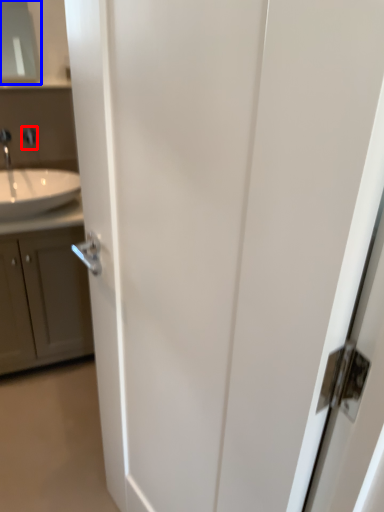
Question: Which of the following is the closest to the observer, faucet (highlighted by a red box) or medicine cabinet (highlighted by a blue box)?

Choices:
 (A) faucet
 (B) medicine cabinet

Answer: (B)